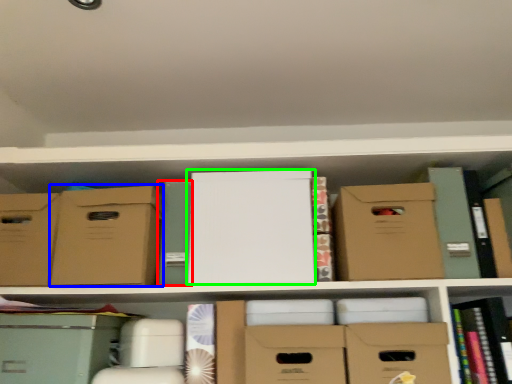
Question: Estimate the real-world distances between objects in this image. Which object is closer to paperback book (highlighted by a red box), cardboard box (highlighted by a blue box) or paperback book (highlighted by a green box)?

Choices:
 (A) cardboard box
 (B) paperback book

Answer: (A)